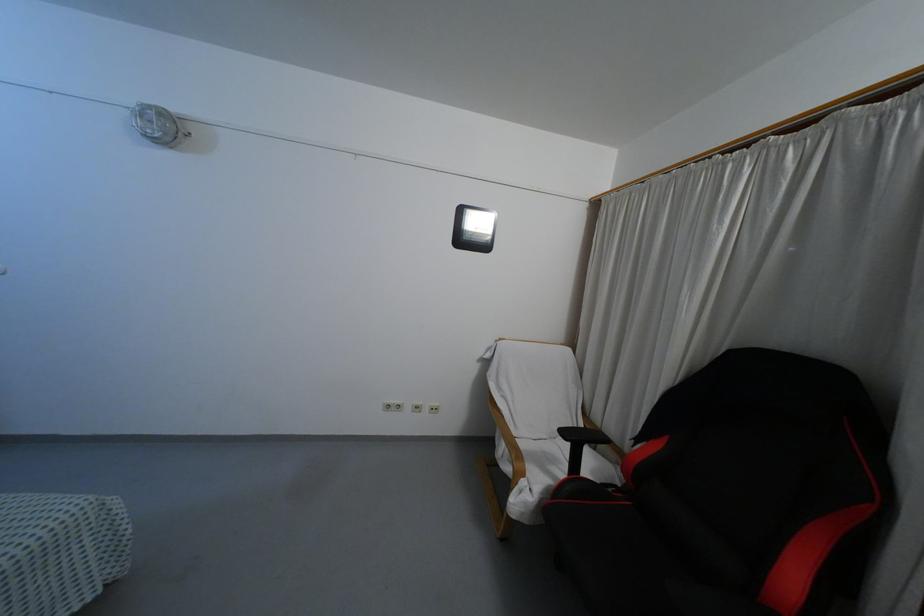
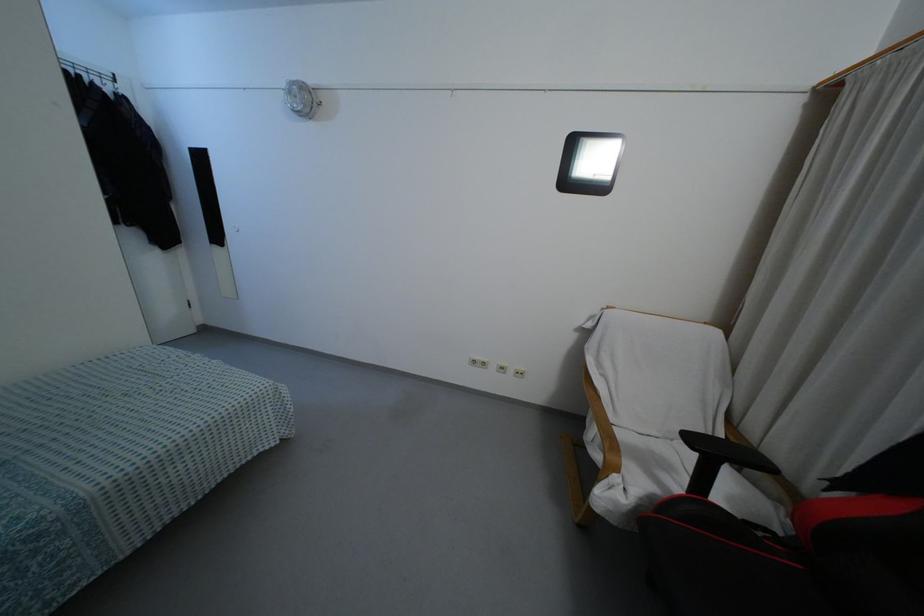
Question: In a continuous first-person perspective shot, in which direction is the camera moving?

Choices:
 (A) Left
 (B) Right
 (C) Forward
 (D) Backward

Answer: (C)